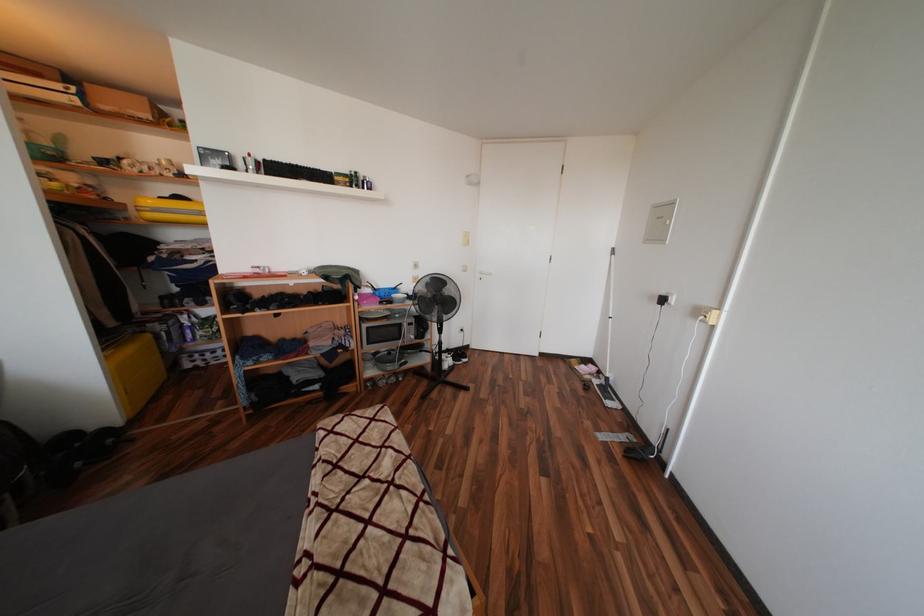
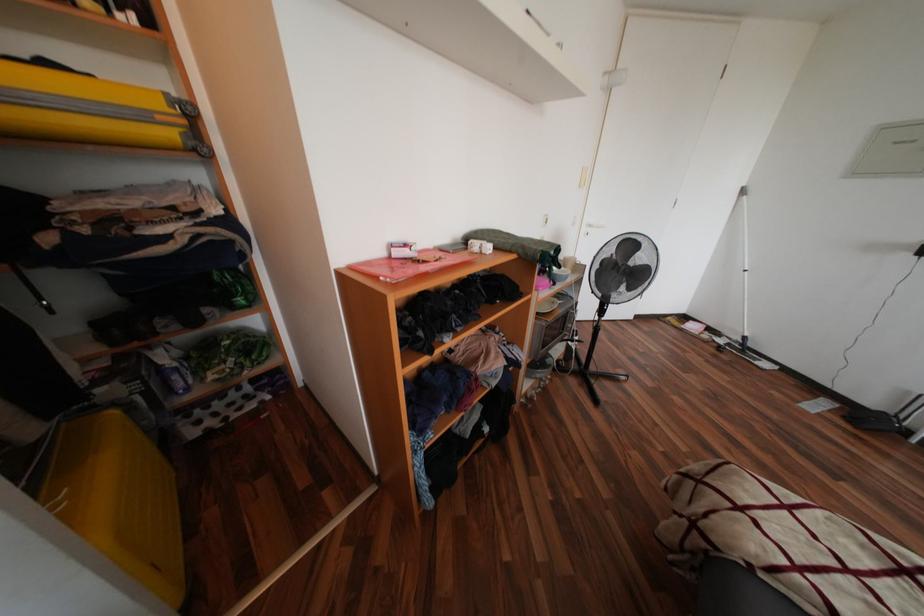
What movement of the cameraman would produce the second image?

The cameraman moved toward left, forward.